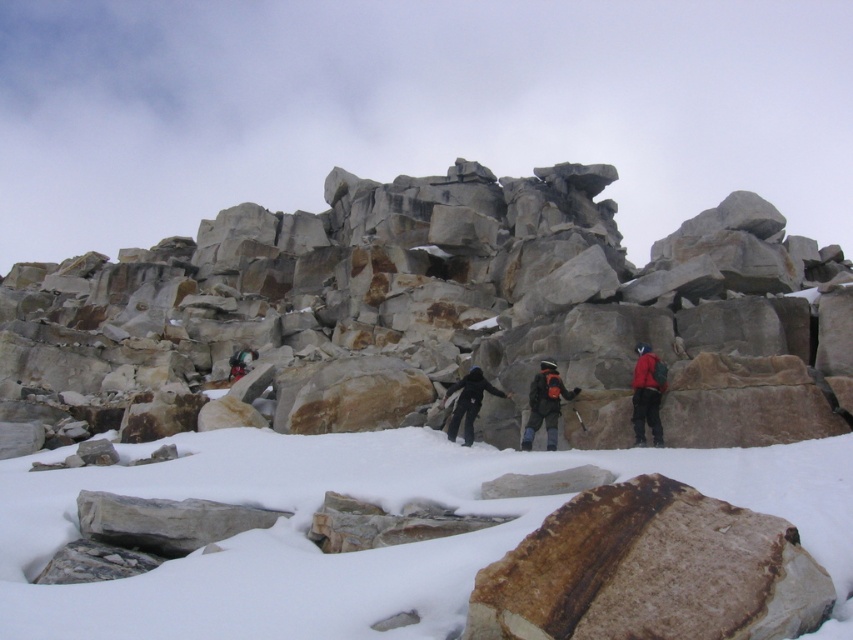
You are standing at the point marked as point [442,316] in the snowy mountainous landscape. What type of terrain feature are you currently standing on?

You are standing on rustic stone boulders at center.

Based on the photo, you are planning to take a photo of the rustic stone boulders at center and the matte black jacket at center. Which object should you zoom in on to capture more details of its texture?

You should zoom in on the rustic stone boulders at center because it is wider than the matte black jacket at center, allowing for more detailed texture capture.